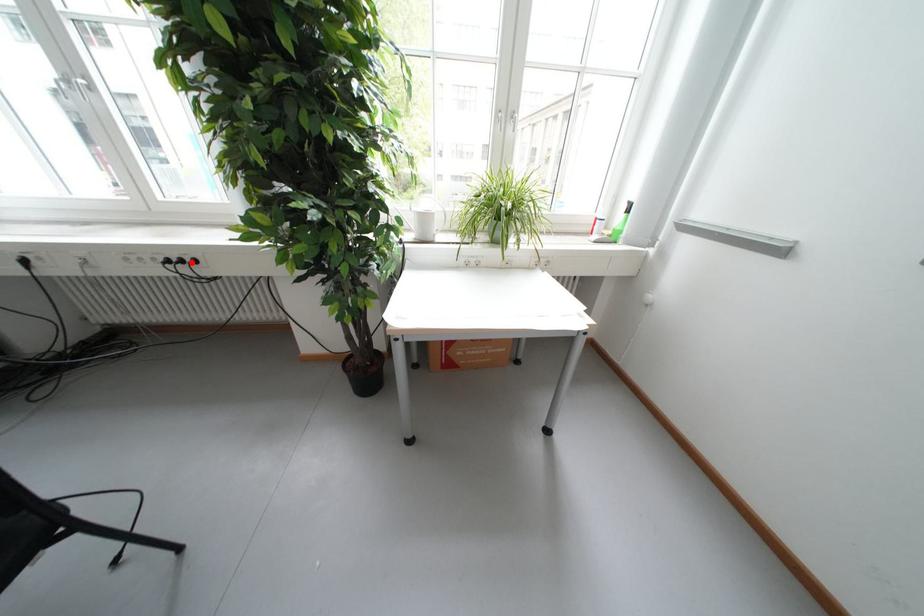
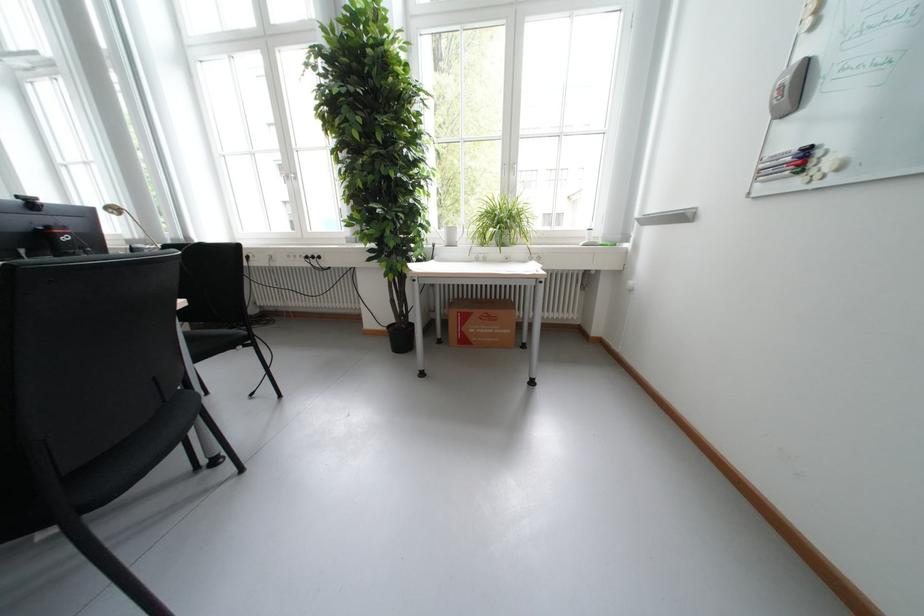
Locate, in the second image, the point that corresponds to the highlighted location in the first image.

(322, 257)